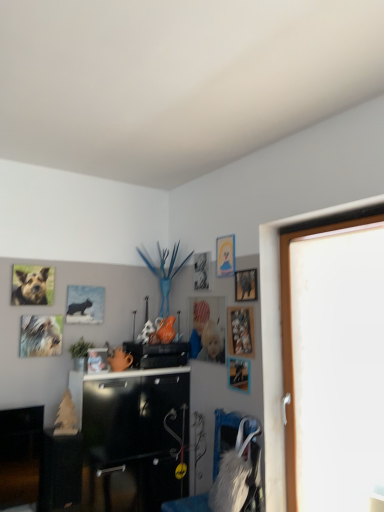
Question: From a real-world perspective, is wooden picture frame at upper right, which is the 2th picture frame from right to left, physically located above or below matte black picture frame at upper left, the first picture frame in the left-to-right sequence?

Choices:
 (A) above
 (B) below

Answer: (B)

Question: In the image, is wooden picture frame at upper right, which ranks as the seventh picture frame in left-to-right order, on the left side or the right side of matte black picture frame at upper left, the first picture frame in the left-to-right sequence?

Choices:
 (A) left
 (B) right

Answer: (B)

Question: Which of these objects is positioned farthest from the metallic gold picture frame at upper center, which ranks as the fourth picture frame in right-to-left order?

Choices:
 (A) white furry swivel chair at center
 (B) wooden picture frame at upper right, which ranks as the seventh picture frame in left-to-right order
 (C) metallic silver picture frame at upper right, marked as the eighth picture frame in a left-to-right arrangement
 (D) metallic silver photo frame at upper center, positioned as the 3th picture frame in left-to-right order
 (E) matte black picture frame at upper left, the first picture frame in the left-to-right sequence

Answer: (A)

Question: Considering the real-world distances, which object is closest to the brown fur dog at upper left, the first animal in the top-to-bottom sequence?

Choices:
 (A) white fur dog at upper left, which is the second animal in top-to-bottom order
 (B) wooden picture frame at upper right, which ranks as the seventh picture frame in left-to-right order
 (C) white furry swivel chair at center
 (D) matte black picture frame at upper left, which is the eighth picture frame from right to left
 (E) metallic silver picture frame at upper right, the first picture frame when ordered from right to left

Answer: (A)